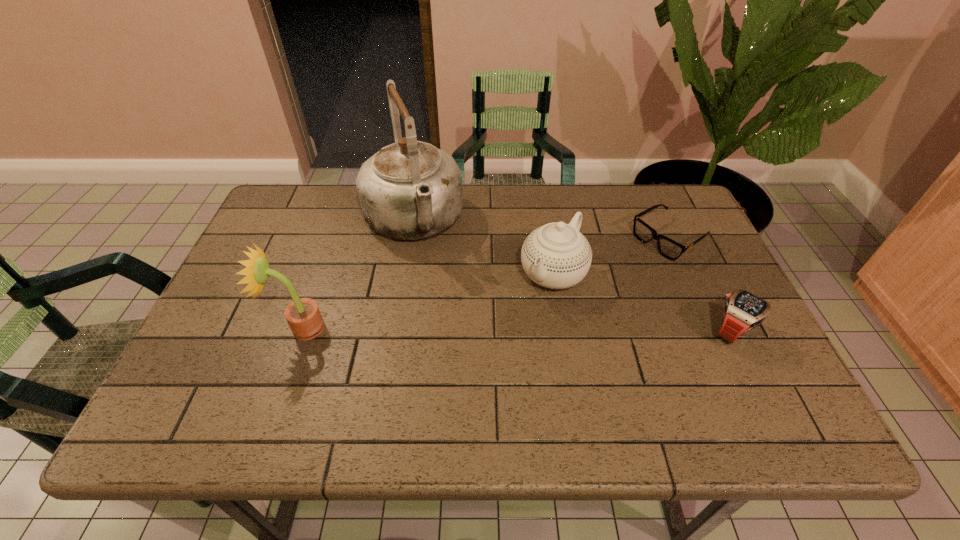
Find the location of a particular element. This screenshot has height=540, width=960. free space located on the front-facing side of the sunglasses is located at coordinates (570, 302).

Locate an element on the screen. kettle located in the far edge section of the desktop is located at coordinates (409, 190).

At what (x,y) coordinates should I click in order to perform the action: click on sunglasses at the far edge. Please return your answer as a coordinate pair (x, y). This screenshot has height=540, width=960. Looking at the image, I should click on (670, 249).

Where is `watch positioned at the right edge`? The width and height of the screenshot is (960, 540). watch positioned at the right edge is located at coordinates (743, 311).

This screenshot has width=960, height=540. I want to click on sunglasses at the right edge, so click(x=670, y=249).

Locate an element on the screen. object located in the far right corner section of the desktop is located at coordinates (670, 249).

At what (x,y) coordinates should I click in order to perform the action: click on vacant space at the far edge of the desktop. Please return your answer as a coordinate pair (x, y). This screenshot has width=960, height=540. Looking at the image, I should click on (465, 190).

Image resolution: width=960 pixels, height=540 pixels. I want to click on vacant space at the near edge of the desktop, so click(486, 362).

The image size is (960, 540). I want to click on vacant space at the left edge, so click(203, 350).

I want to click on blank region between the leftmost object and the tallest object, so click(x=357, y=274).